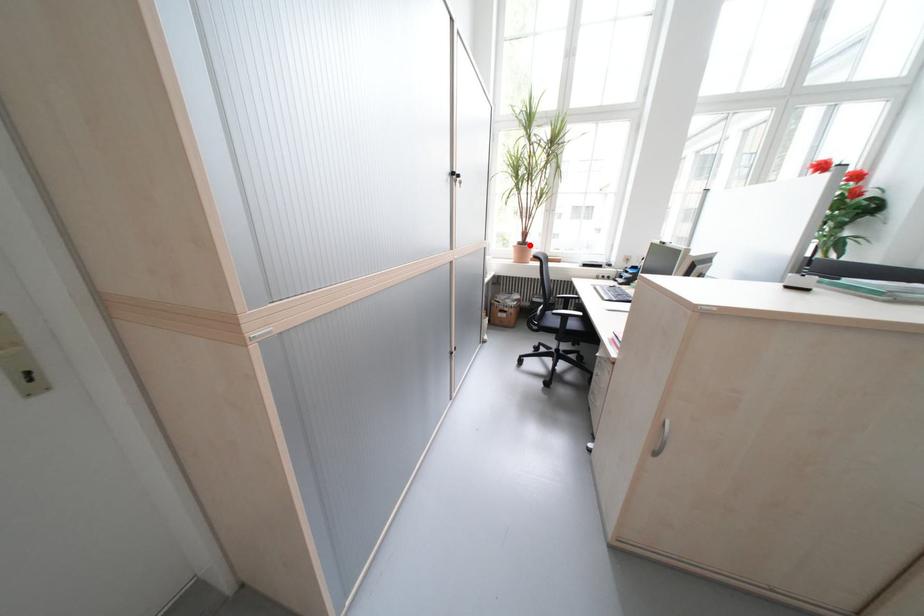
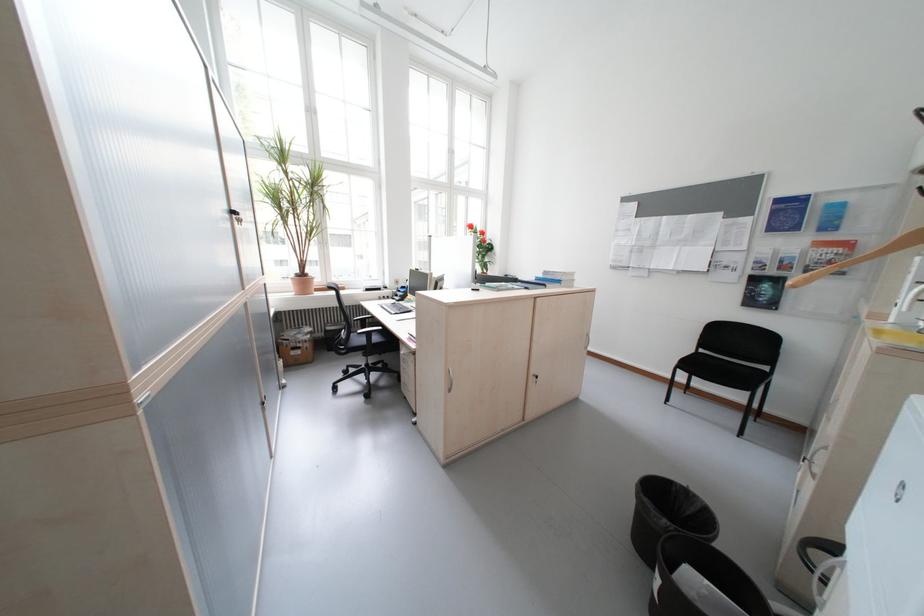
In the second image, find the point that corresponds to the highlighted location in the first image.

(308, 277)